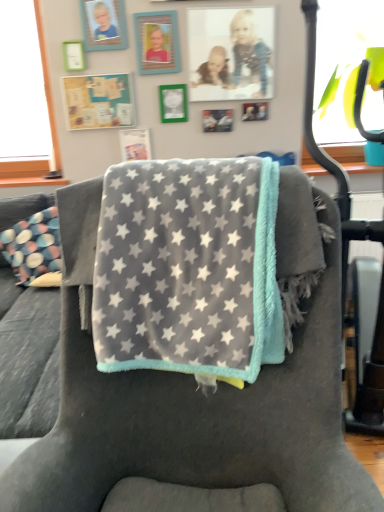
Question: Does green matte picture frame at upper left, the 7th picture frame viewed from the right, touch matte black picture frame at center, which ranks as the 5th picture frame in left-to-right order?

Choices:
 (A) yes
 (B) no

Answer: (B)

Question: Is green matte picture frame at upper left, the 7th picture frame viewed from the right, far from matte black picture frame at center, placed as the 3th picture frame when sorted from right to left?

Choices:
 (A) no
 (B) yes

Answer: (A)

Question: From a real-world perspective, is green matte picture frame at upper left, the 7th picture frame viewed from the right, over matte black picture frame at center, placed as the 3th picture frame when sorted from right to left?

Choices:
 (A) yes
 (B) no

Answer: (A)

Question: From a real-world perspective, does green matte picture frame at upper left, the 7th picture frame viewed from the right, sit lower than matte black picture frame at center, which ranks as the 5th picture frame in left-to-right order?

Choices:
 (A) no
 (B) yes

Answer: (A)

Question: Does green matte picture frame at upper left, the 7th picture frame viewed from the right, have a lesser height compared to matte black picture frame at center, placed as the 3th picture frame when sorted from right to left?

Choices:
 (A) no
 (B) yes

Answer: (A)

Question: Considering the positions of wooden picture frame at upper left, positioned as the 6th picture frame in right-to-left order, and matte black picture frame at center, placed as the 3th picture frame when sorted from right to left, in the image, is wooden picture frame at upper left, positioned as the 6th picture frame in right-to-left order, taller or shorter than matte black picture frame at center, placed as the 3th picture frame when sorted from right to left,?

Choices:
 (A) short
 (B) tall

Answer: (B)

Question: From the image's perspective, relative to matte black picture frame at center, placed as the 3th picture frame when sorted from right to left, is wooden picture frame at upper left, positioned as the 6th picture frame in right-to-left order, above or below?

Choices:
 (A) above
 (B) below

Answer: (A)

Question: Visually, is wooden picture frame at upper left, which is the 2th picture frame from left to right, positioned to the left or to the right of matte black picture frame at center, which ranks as the 5th picture frame in left-to-right order?

Choices:
 (A) left
 (B) right

Answer: (A)

Question: Based on their sizes in the image, would you say wooden picture frame at upper left, positioned as the 6th picture frame in right-to-left order, is bigger or smaller than matte black picture frame at center, which ranks as the 5th picture frame in left-to-right order?

Choices:
 (A) small
 (B) big

Answer: (B)

Question: Considering the positions of gray plush blanket at center and matte black picture frame at center, placed as the 3th picture frame when sorted from right to left, in the image, is gray plush blanket at center bigger or smaller than matte black picture frame at center, placed as the 3th picture frame when sorted from right to left,?

Choices:
 (A) big
 (B) small

Answer: (A)

Question: Considering the positions of gray plush blanket at center and matte black picture frame at center, which ranks as the 5th picture frame in left-to-right order, in the image, is gray plush blanket at center wider or thinner than matte black picture frame at center, which ranks as the 5th picture frame in left-to-right order,?

Choices:
 (A) thin
 (B) wide

Answer: (B)

Question: Considering the positions of point (296, 460) and point (203, 123), is point (296, 460) closer or farther from the camera than point (203, 123)?

Choices:
 (A) farther
 (B) closer

Answer: (B)

Question: Is gray plush blanket at center inside the boundaries of matte black picture frame at center, placed as the 3th picture frame when sorted from right to left, or outside?

Choices:
 (A) inside
 (B) outside

Answer: (B)

Question: Considering the relative positions of wooden picture frame at upper left, which is the 2th picture frame from left to right, and metallic silver photo frame at upper center, the first picture frame from the right, in the image provided, is wooden picture frame at upper left, which is the 2th picture frame from left to right, to the left or to the right of metallic silver photo frame at upper center, the first picture frame from the right,?

Choices:
 (A) right
 (B) left

Answer: (B)

Question: Relative to metallic silver photo frame at upper center, the first picture frame from the right, is wooden picture frame at upper left, positioned as the 6th picture frame in right-to-left order, in front or behind?

Choices:
 (A) behind
 (B) front

Answer: (B)